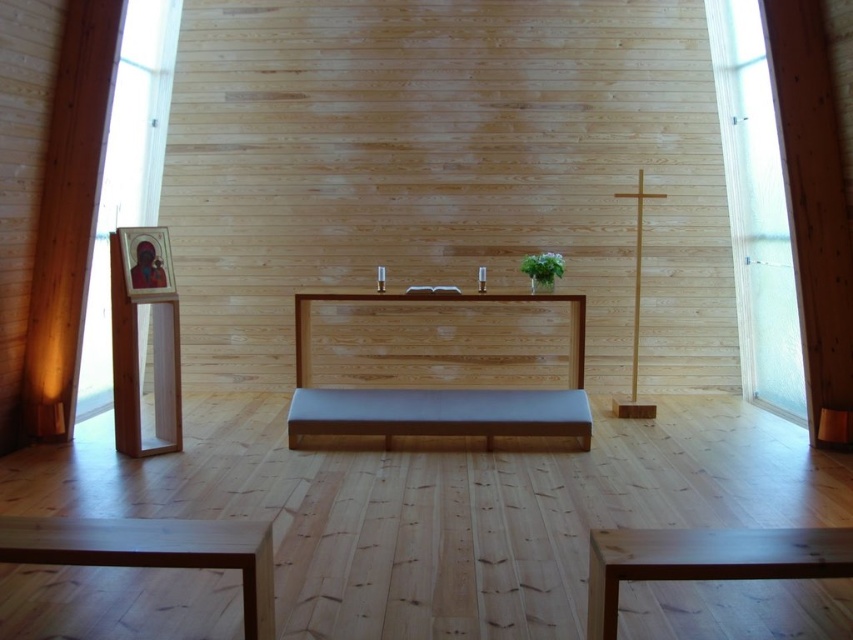
Which is below, frosted glass window at right or light brown wooden stool at lower left?

light brown wooden stool at lower left

In the scene shown: How distant is frosted glass window at right from light brown wooden stool at lower left?

4.70 meters

What do you see at coordinates (756, 211) in the screenshot? This screenshot has width=853, height=640. I see `frosted glass window at right` at bounding box center [756, 211].

I want to click on frosted glass window at right, so click(x=756, y=211).

Is frosted glass window at right wider than natural wood stool at lower center?

No.

Does frosted glass window at right come behind natural wood stool at lower center?

Yes, it is behind natural wood stool at lower center.

I want to click on frosted glass window at right, so click(x=756, y=211).

Does smooth brown bench at center have a smaller size compared to natural wood pulpit at center?

Yes, smooth brown bench at center is smaller than natural wood pulpit at center.

Can you confirm if smooth brown bench at center is positioned to the left of natural wood pulpit at center?

In fact, smooth brown bench at center is to the right of natural wood pulpit at center.

Which is behind, point (579, 392) or point (583, 337)?

The point (583, 337) is more distant.

This screenshot has height=640, width=853. Find the location of `smooth brown bench at center`. smooth brown bench at center is located at coordinates (439, 413).